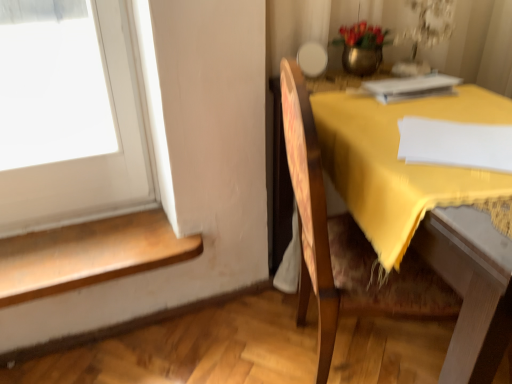
In order to click on metallic vase at upper center in this screenshot , I will do `click(361, 47)`.

Measure the distance between wooden chair at right and camera.

76.46 centimeters.

You are a GUI agent. You are given a task and a screenshot of the screen. Output one action in this format:
    pyautogui.click(x=<x>, y=<y>)
    Task: Click on the wooden step at lower left
    The image size is (512, 384).
    Given the screenshot: What is the action you would take?
    pyautogui.click(x=89, y=254)

In the scene shown: From the image's perspective, which one is positioned lower, yellow fabric at right or metallic vase at upper center?

yellow fabric at right.

From the picture: How much distance is there between yellow fabric at right and metallic vase at upper center?

The distance of yellow fabric at right from metallic vase at upper center is 14.92 inches.

Is yellow fabric at right further to the viewer compared to metallic vase at upper center?

No, yellow fabric at right is closer to the camera.

Is yellow fabric at right far away from metallic vase at upper center?

Actually, yellow fabric at right and metallic vase at upper center are a little close together.

Does yellow fabric at right touch wooden step at lower left?

yellow fabric at right and wooden step at lower left are not in contact.

Is yellow fabric at right inside or outside of wooden step at lower left?

The correct answer is: outside.

Is yellow fabric at right smaller than wooden step at lower left?

Incorrect, yellow fabric at right is not smaller in size than wooden step at lower left.

From a real-world perspective, who is located higher, wooden chair at right or wooden step at lower left?

wooden chair at right is physically above.

From the image's perspective, is wooden chair at right located above wooden step at lower left?

Yes, from the image's perspective, wooden chair at right is above wooden step at lower left.

Find the location of a particular element. This screenshot has height=384, width=512. chair to the right of wooden step at lower left is located at coordinates (323, 226).

Consider the image. Is wooden chair at right shorter than wooden step at lower left?

No, wooden chair at right is not shorter than wooden step at lower left.

Can you confirm if metallic vase at upper center is smaller than wooden chair at right?

Yes, metallic vase at upper center is smaller than wooden chair at right.

Is metallic vase at upper center to the left of wooden chair at right from the viewer's perspective?

Yes, metallic vase at upper center is to the left of wooden chair at right.

Considering the positions of points (361, 41) and (303, 117), is point (361, 41) farther from camera compared to point (303, 117)?

Yes, it is behind point (303, 117).

Is metallic vase at upper center far from wooden chair at right?

metallic vase at upper center is actually quite close to wooden chair at right.

Which is behind, point (327, 123) or point (292, 169)?

Point (327, 123)

Is yellow fabric at right taller than wooden chair at right?

No.

Locate an element on the screen. This screenshot has width=512, height=384. tablecloth that appears above the wooden chair at right (from a real-world perspective) is located at coordinates (401, 161).

From a real-world perspective, does yellow fabric at right sit lower than wooden chair at right?

Actually, yellow fabric at right is physically above wooden chair at right in the real world.

From a real-world perspective, is wooden chair at right positioned over metallic vase at upper center based on gravity?

No.

Is wooden chair at right facing towards metallic vase at upper center?

No, wooden chair at right is not facing towards metallic vase at upper center.

Does point (397, 311) lie in front of point (357, 25)?

Yes, it is in front of point (357, 25).

From the picture: From the image's perspective, is white paper at upper right on top of wooden step at lower left?

Correct, white paper at upper right appears higher than wooden step at lower left in the image.

The width and height of the screenshot is (512, 384). Identify the location of book on the right of wooden step at lower left. (410, 87).

Is white paper at upper right turned away from wooden step at lower left?

No.

Locate an element on the screen. This screenshot has height=384, width=512. tablecloth below the metallic vase at upper center (from a real-world perspective) is located at coordinates (401, 161).

Find the location of a particular element. stairwell lying behind the yellow fabric at right is located at coordinates (89, 254).

When comparing their distances from metallic vase at upper center, does yellow fabric at right or white paper at upper right seem further?

yellow fabric at right is positioned further to the anchor metallic vase at upper center.

Which object lies further to the anchor point wooden chair at right, metallic vase at upper center or white paper at upper right?

The object further to wooden chair at right is metallic vase at upper center.

From the image, which object appears to be farther from wooden chair at right, white paper at upper right or metallic vase at upper center?

Among the two, metallic vase at upper center is located further to wooden chair at right.

Based on their spatial positions, is wooden step at lower left or yellow fabric at right closer to white paper at upper right?

yellow fabric at right is closer to white paper at upper right.

Considering their positions, is wooden step at lower left positioned closer to wooden chair at right than yellow fabric at right?

yellow fabric at right lies closer to wooden chair at right than the other object.

Estimate the real-world distances between objects in this image. Which object is closer to wooden step at lower left, wooden chair at right or white paper at upper right?

Based on the image, wooden chair at right appears to be nearer to wooden step at lower left.

Looking at the image, which one is located further to white paper at upper right, wooden step at lower left or metallic vase at upper center?

wooden step at lower left is further to white paper at upper right.

Consider the image. Looking at the image, which one is located closer to white paper at upper right, metallic vase at upper center or wooden step at lower left?

metallic vase at upper center is positioned closer to the anchor white paper at upper right.

Locate an element on the screen. book located between wooden step at lower left and wooden chair at right in the left-right direction is located at coordinates (410, 87).

In order to click on tablecloth between wooden chair at right and white paper at upper right in the front-back direction in this screenshot , I will do `click(401, 161)`.

Where is `floral arrangement between wooden step at lower left and wooden chair at right`? floral arrangement between wooden step at lower left and wooden chair at right is located at coordinates (361, 47).

Identify the location of book positioned between wooden chair at right and metallic vase at upper center from near to far. (410, 87).